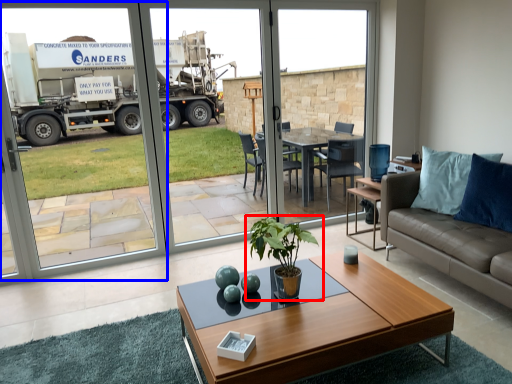
Question: Which of the following is the closest to the observer, houseplant (highlighted by a red box) or screen door (highlighted by a blue box)?

Choices:
 (A) houseplant
 (B) screen door

Answer: (A)